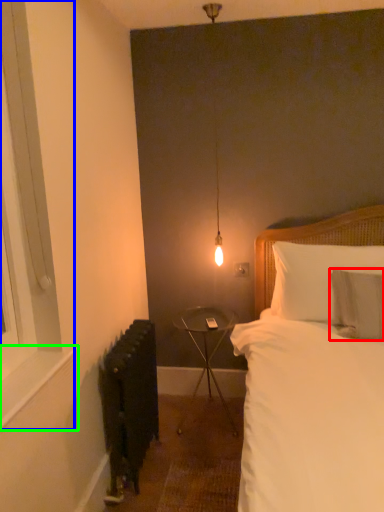
Question: Considering the real-world distances, which object is farthest from pillow (highlighted by a red box)? window (highlighted by a blue box) or window sill (highlighted by a green box)?

Choices:
 (A) window
 (B) window sill

Answer: (A)